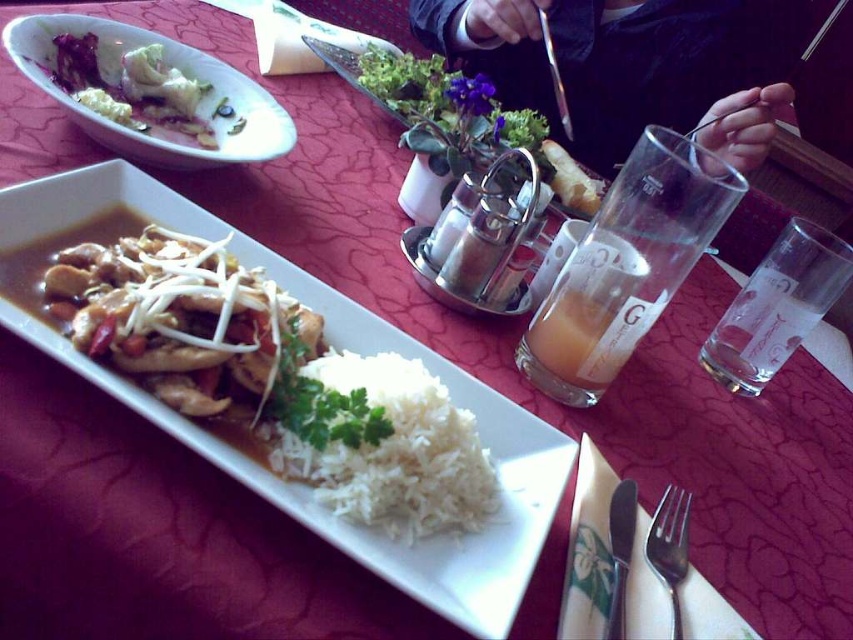
You are a photographer taking a picture of the dining table. You notice two points marked on the table. One is at point (x=192, y=145) and the other is at point (x=628, y=547). Which point is closer to your camera?

Point (x=192, y=145) is further to the camera than point (x=628, y=547), so the point closer to the camera is point (x=628, y=547).

You are a server at the restaurant and need to place a new dish on the table. The dish is 12 inches wide. There is space between the dark suit jacket at upper center and the white creamy mashed potatoes at upper left. Can you fit the dish there?

The dark suit jacket at upper center might be wider than white creamy mashed potatoes at upper left, so the space between them may not be wide enough for a 12 inch dish. Check the exact width before placing.